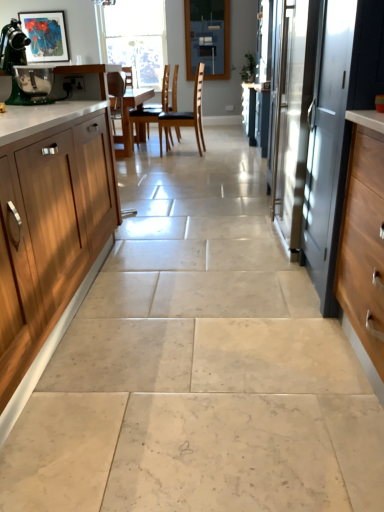
Find the location of `vacant space to the left of satin silver screen door at right`. vacant space to the left of satin silver screen door at right is located at coordinates (223, 242).